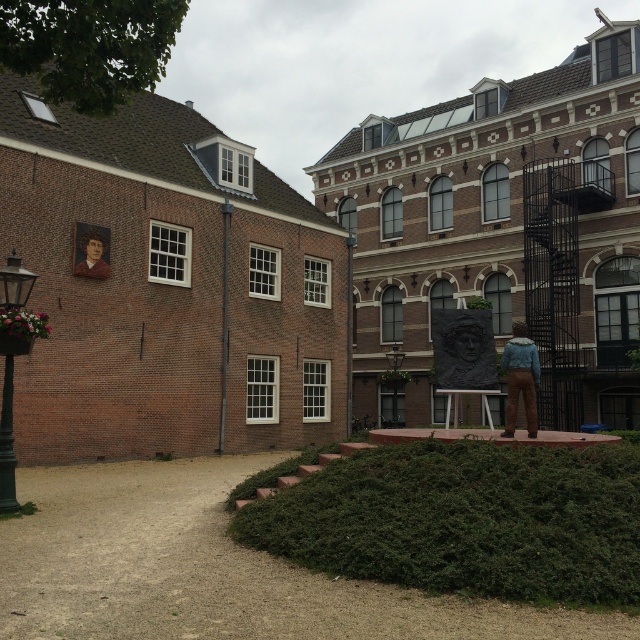
Question: Which object is positioned farthest from the black metal pole at center?

Choices:
 (A) black stone relief at center
 (B) green painted metal streetlamp at left
 (C) blue denim jacket at lower right

Answer: (B)

Question: Among these objects, which one is nearest to the camera?

Choices:
 (A) blue denim jacket at lower right
 (B) brown brick pole at center

Answer: (A)

Question: Considering the relative positions of brown brick pole at center and black metal pole at center in the image provided, where is brown brick pole at center located with respect to black metal pole at center?

Choices:
 (A) above
 (B) below

Answer: (B)

Question: Is green painted metal streetlamp at left to the left of black metal pole at center from the viewer's perspective?

Choices:
 (A) yes
 (B) no

Answer: (A)

Question: Does black stone relief at center have a larger size compared to smooth brown portrait at upper left?

Choices:
 (A) no
 (B) yes

Answer: (B)

Question: Among these points, which one is nearest to the camera?

Choices:
 (A) (524, 378)
 (B) (8, 284)
 (C) (86, 244)

Answer: (B)